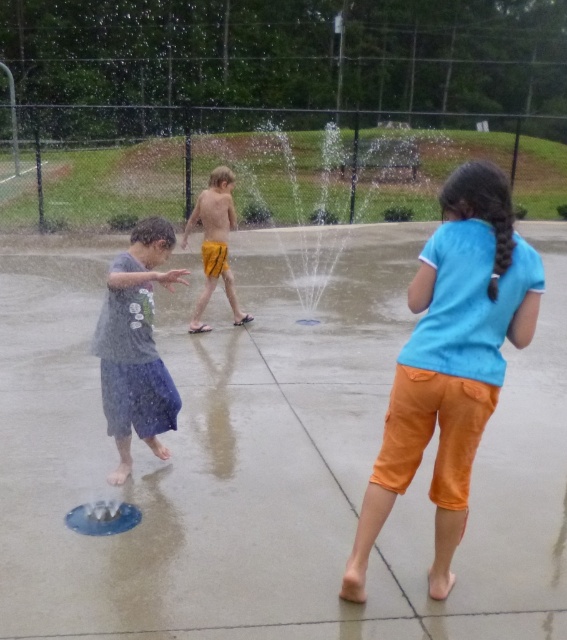
Is blue cotton shirt at center below gray cotton shirt at left?

Yes.

Is point (471, 381) in front of point (133, 348)?

Yes, point (471, 381) is closer to viewer.

Is point (404, 486) in front of point (143, 269)?

That is True.

Locate an element on the screen. The height and width of the screenshot is (640, 567). blue cotton shirt at center is located at coordinates (451, 362).

Which is more to the left, blue cotton shirt at center or yellow matte shorts at center?

Result: yellow matte shorts at center

In the scene shown: Does blue cotton shirt at center appear on the left side of yellow matte shorts at center?

No, blue cotton shirt at center is not to the left of yellow matte shorts at center.

Which is behind, point (437, 355) or point (221, 198)?

The point (221, 198) is behind.

Where is `blue cotton shirt at center`? The width and height of the screenshot is (567, 640). blue cotton shirt at center is located at coordinates (451, 362).

Between gray cotton shirt at left and yellow matte shorts at center, which one appears on the right side from the viewer's perspective?

yellow matte shorts at center

Which is in front, point (170, 390) or point (189, 220)?

Point (170, 390) is more forward.

Where is `gray cotton shirt at left`? The image size is (567, 640). gray cotton shirt at left is located at coordinates (136, 346).